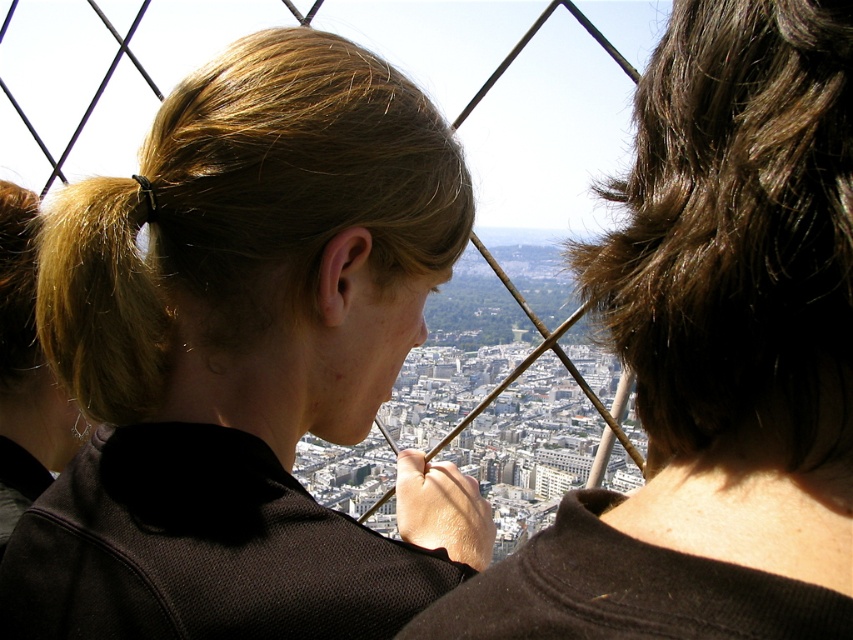
You are a photographer standing in front of the city view. You notice two people with blonde hair at center and blonde hair at left. Which one is closer to you?

The blonde hair at center is closer to the viewer than the blonde hair at left.

You are a photographer trying to capture a clear shot of the cityscape from this vantage point. There are two people blocking your view with their blonde hair at center and blonde hair at left. Which person should you move around to avoid blocking the view?

You should move around the blonde hair at left because the blonde hair at center is taller and would still block the view even if you avoid the shorter one.